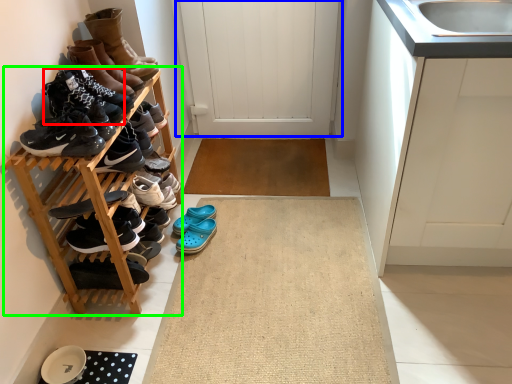
Question: Based on their relative distances, which object is farther from footwear (highlighted by a red box)? Choose from door (highlighted by a blue box) and shelf (highlighted by a green box).

Choices:
 (A) door
 (B) shelf

Answer: (A)